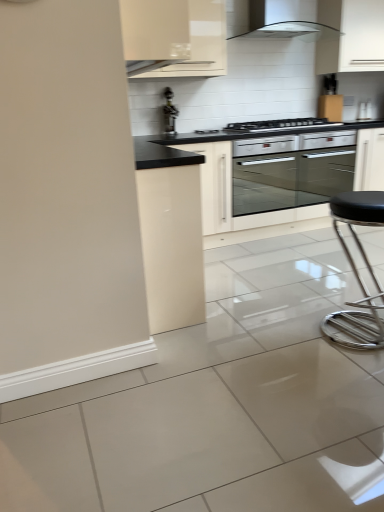
In order to face metallic gold faucet at upper center, should I rotate leftwards or rightwards?

Rotate your view left by about 2.807°.

The width and height of the screenshot is (384, 512). In order to click on white glossy cabinet at upper center, acting as the second cabinetry starting from the back in this screenshot , I will do `click(174, 37)`.

Locate an element on the screen. metallic silver bar stool at right is located at coordinates (357, 274).

Describe the element at coordinates (291, 170) in the screenshot. I see `satin silver oven at center` at that location.

I want to click on satin silver oven at center, so click(291, 170).

At what (x,y) coordinates should I click in order to perform the action: click on white glossy range hood at upper center. Please return your answer as a coordinate pair (x, y). The width and height of the screenshot is (384, 512). Looking at the image, I should click on (278, 19).

The image size is (384, 512). Find the location of `metallic gold faucet at upper center`. metallic gold faucet at upper center is located at coordinates (169, 112).

Between white glossy cabinet at upper right, placed as the first cabinetry when sorted from right to left, and white glossy range hood at upper center, which one has larger width?

white glossy range hood at upper center.

In the scene shown: Considering the sizes of objects white glossy cabinet at upper right, arranged as the second cabinetry when viewed from the left, and white glossy range hood at upper center in the image provided, who is taller, white glossy cabinet at upper right, arranged as the second cabinetry when viewed from the left, or white glossy range hood at upper center?

Standing taller between the two is white glossy cabinet at upper right, arranged as the second cabinetry when viewed from the left.

In terms of size, does white glossy cabinet at upper right, arranged as the second cabinetry when viewed from the left, appear bigger or smaller than white glossy range hood at upper center?

white glossy cabinet at upper right, arranged as the second cabinetry when viewed from the left, is bigger than white glossy range hood at upper center.

How distant is white glossy cabinet at upper right, placed as the second cabinetry when sorted from front to back, from white glossy range hood at upper center?

white glossy cabinet at upper right, placed as the second cabinetry when sorted from front to back, is 28.36 centimeters from white glossy range hood at upper center.

Does black glass cooktop at center lie behind metallic silver bar stool at right?

That is True.

From a real-world perspective, which is physically below, black glass cooktop at center or metallic silver bar stool at right?

From a 3D spatial view, metallic silver bar stool at right is below.

Are black glass cooktop at center and metallic silver bar stool at right beside each other?

There is a gap between black glass cooktop at center and metallic silver bar stool at right.

Can you confirm if black glass cooktop at center is thinner than metallic silver bar stool at right?

Incorrect, the width of black glass cooktop at center is not less than that of metallic silver bar stool at right.

Does black glass cooktop at center lie behind white glossy cabinet at upper right, which is the first cabinetry from back to front?

That is False.

In the scene shown: Does black glass cooktop at center turn towards white glossy cabinet at upper right, placed as the first cabinetry when sorted from right to left?

No, black glass cooktop at center is not facing towards white glossy cabinet at upper right, placed as the first cabinetry when sorted from right to left.

From a real-world perspective, relative to white glossy cabinet at upper right, which is the first cabinetry from back to front, is black glass cooktop at center vertically above or below?

From a real-world perspective, black glass cooktop at center is physically below white glossy cabinet at upper right, which is the first cabinetry from back to front.

Identify the location of cabinetry on the right of black glass cooktop at center. click(x=351, y=36).

Considering the relative sizes of white glossy cabinet at upper right, which is the first cabinetry from back to front, and white glossy cabinet at upper center, acting as the second cabinetry starting from the back, in the image provided, is white glossy cabinet at upper right, which is the first cabinetry from back to front, shorter than white glossy cabinet at upper center, acting as the second cabinetry starting from the back,?

Incorrect, the height of white glossy cabinet at upper right, which is the first cabinetry from back to front, does not fall short of that of white glossy cabinet at upper center, acting as the second cabinetry starting from the back.

At what (x,y) coordinates should I click in order to perform the action: click on cabinetry on the right of white glossy cabinet at upper center, acting as the second cabinetry starting from the back. Please return your answer as a coordinate pair (x, y). This screenshot has width=384, height=512. Looking at the image, I should click on (351, 36).

Would you say white glossy cabinet at upper right, arranged as the second cabinetry when viewed from the left, contains white glossy cabinet at upper center, the 1th cabinetry from the left?

No, white glossy cabinet at upper center, the 1th cabinetry from the left, is not a part of white glossy cabinet at upper right, arranged as the second cabinetry when viewed from the left.

In the image, is white glossy cabinet at upper right, placed as the first cabinetry when sorted from right to left, positioned in front of or behind white glossy cabinet at upper center, the first cabinetry from the front?

white glossy cabinet at upper right, placed as the first cabinetry when sorted from right to left, is behind white glossy cabinet at upper center, the first cabinetry from the front.

Is white glossy cabinet at upper center, acting as the second cabinetry starting from the back, at the left side of white glossy range hood at upper center?

Yes, white glossy cabinet at upper center, acting as the second cabinetry starting from the back, is to the left of white glossy range hood at upper center.

Is white glossy cabinet at upper center, the 2th cabinetry from the right, shorter than white glossy range hood at upper center?

No.

From the image's perspective, which is below, white glossy cabinet at upper center, the 2th cabinetry from the right, or white glossy range hood at upper center?

white glossy cabinet at upper center, the 2th cabinetry from the right, from the image's perspective.

Is white glossy cabinet at upper center, acting as the second cabinetry starting from the back, oriented towards white glossy range hood at upper center?

No, white glossy cabinet at upper center, acting as the second cabinetry starting from the back, is not aimed at white glossy range hood at upper center.

Between satin silver oven at center and metallic gold faucet at upper center, which one is positioned behind?

satin silver oven at center is more distant.

From a real-world perspective, is satin silver oven at center positioned over metallic gold faucet at upper center based on gravity?

Actually, satin silver oven at center is physically below metallic gold faucet at upper center in the real world.

Considering the relative positions of satin silver oven at center and metallic gold faucet at upper center in the image provided, is satin silver oven at center to the left of metallic gold faucet at upper center from the viewer's perspective?

In fact, satin silver oven at center is to the right of metallic gold faucet at upper center.

From a real-world perspective, which object stands above the other?

From a 3D spatial view, white glossy cabinet at upper center, the 1th cabinetry from the left, is above.

Does satin silver oven at center come behind white glossy cabinet at upper center, the 1th cabinetry from the left?

Yes.

Is satin silver oven at center wider than white glossy cabinet at upper center, acting as the second cabinetry starting from the back?

Indeed, satin silver oven at center has a greater width compared to white glossy cabinet at upper center, acting as the second cabinetry starting from the back.

Does satin silver oven at center appear on the left side of white glossy cabinet at upper center, acting as the second cabinetry starting from the back?

No.

At what (x,y) coordinates should I click in order to perform the action: click on cabinetry that is above the white glossy range hood at upper center (from the image's perspective). Please return your answer as a coordinate pair (x, y). Looking at the image, I should click on (351, 36).

Where is `bar stool located on the right of black glass cooktop at center`? The height and width of the screenshot is (512, 384). bar stool located on the right of black glass cooktop at center is located at coordinates [x=357, y=274].

From the image, which object appears to be nearer to black glass cooktop at center, white glossy range hood at upper center or white glossy cabinet at upper right, placed as the second cabinetry when sorted from front to back?

The object closer to black glass cooktop at center is white glossy cabinet at upper right, placed as the second cabinetry when sorted from front to back.

Based on their spatial positions, is white glossy cabinet at upper right, which is the first cabinetry from back to front, or metallic gold faucet at upper center closer to satin silver oven at center?

white glossy cabinet at upper right, which is the first cabinetry from back to front, is positioned closer to the anchor satin silver oven at center.

When comparing their distances from satin silver oven at center, does white glossy cabinet at upper center, the 2th cabinetry from the right, or metallic silver bar stool at right seem closer?

Based on the image, white glossy cabinet at upper center, the 2th cabinetry from the right, appears to be nearer to satin silver oven at center.

Based on their spatial positions, is white glossy cabinet at upper center, the 2th cabinetry from the right, or metallic silver bar stool at right further from white glossy cabinet at upper right, arranged as the second cabinetry when viewed from the left?

metallic silver bar stool at right is further to white glossy cabinet at upper right, arranged as the second cabinetry when viewed from the left.

When comparing their distances from metallic gold faucet at upper center, does white glossy range hood at upper center or black glass cooktop at center seem closer?

Among the two, black glass cooktop at center is located nearer to metallic gold faucet at upper center.

Based on the photo, estimate the real-world distances between objects in this image. Which object is further from white glossy range hood at upper center, white glossy cabinet at upper center, the first cabinetry from the front, or satin silver oven at center?

The object further to white glossy range hood at upper center is satin silver oven at center.

Which object lies further to the anchor point metallic gold faucet at upper center, satin silver oven at center or white glossy cabinet at upper center, the 2th cabinetry from the right?

satin silver oven at center is further to metallic gold faucet at upper center.

When comparing their distances from white glossy range hood at upper center, does white glossy cabinet at upper right, placed as the first cabinetry when sorted from right to left, or black glass cooktop at center seem further?

black glass cooktop at center lies further to white glossy range hood at upper center than the other object.

Find the location of a particular element. The height and width of the screenshot is (512, 384). kitchen appliance between white glossy range hood at upper center and satin silver oven at center in the vertical direction is located at coordinates (277, 125).

Locate an element on the screen. The image size is (384, 512). appliance located between metallic silver bar stool at right and satin silver oven at center in the depth direction is located at coordinates (169, 112).

This screenshot has width=384, height=512. I want to click on kitchen appliance between metallic silver bar stool at right and metallic gold faucet at upper center from front to back, so click(x=277, y=125).

Where is `home appliance located between white glossy cabinet at upper center, the first cabinetry from the front, and satin silver oven at center in the left-right direction`? home appliance located between white glossy cabinet at upper center, the first cabinetry from the front, and satin silver oven at center in the left-right direction is located at coordinates (278, 19).